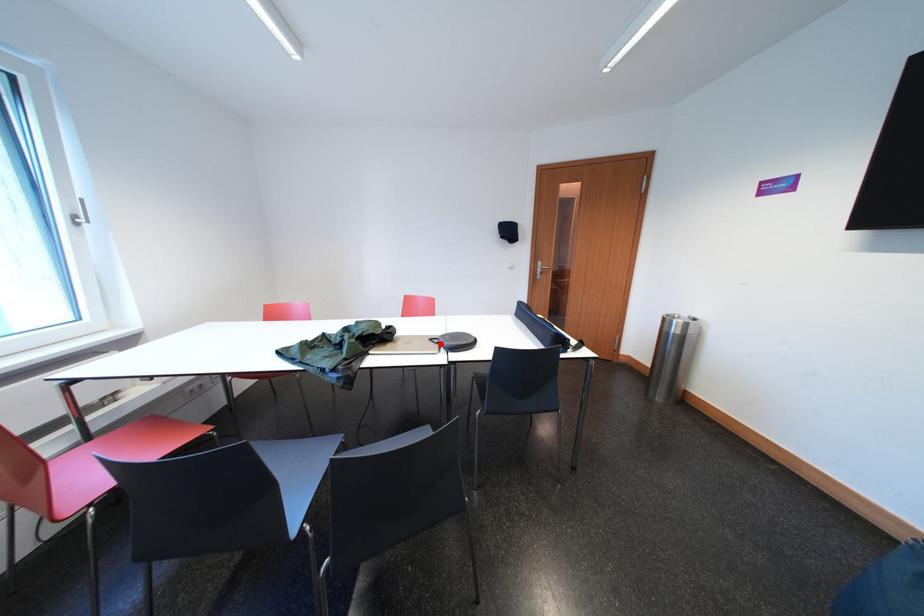
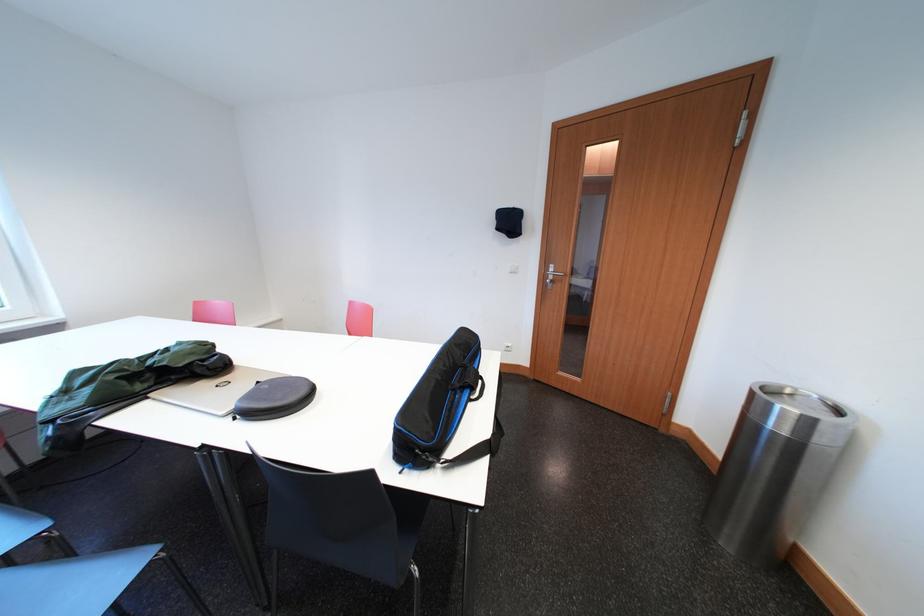
Find the pixel in the second image that matches the highlighted location in the first image.

(268, 387)